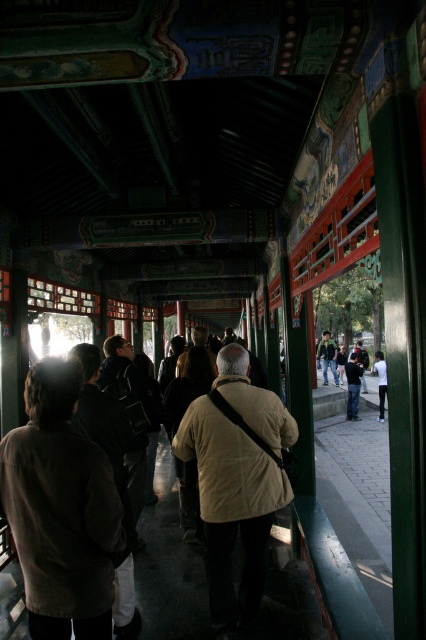
Question: Which object is farther from the camera taking this photo?

Choices:
 (A) white cotton shirt at right
 (B) brown suede jacket at center
 (C) dark brown leather jacket at center
 (D) gray concrete pavement at lower right

Answer: (C)

Question: Is dark brown leather jacket at center to the left of white cotton shirt at right from the viewer's perspective?

Choices:
 (A) yes
 (B) no

Answer: (A)

Question: Can you confirm if gray concrete pavement at lower right is bigger than light beige jacket at center?

Choices:
 (A) no
 (B) yes

Answer: (B)

Question: Which object appears closest to the camera in this image?

Choices:
 (A) light beige jacket at center
 (B) brown suede jacket at center
 (C) gray concrete pavement at lower right
 (D) dark brown leather jacket at center

Answer: (B)

Question: Among these objects, which one is farthest from the camera?

Choices:
 (A) green fabric jacket at center
 (B) gray concrete pavement at lower right

Answer: (A)

Question: Does light beige jacket at center appear under green fabric jacket at center?

Choices:
 (A) no
 (B) yes

Answer: (A)